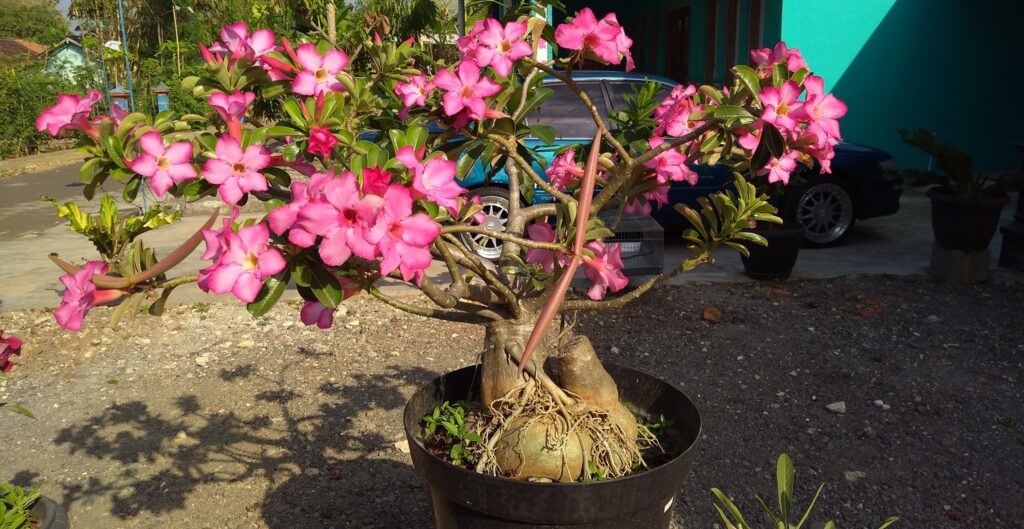
Where is `pot`? The height and width of the screenshot is (529, 1024). pot is located at coordinates (969, 195).